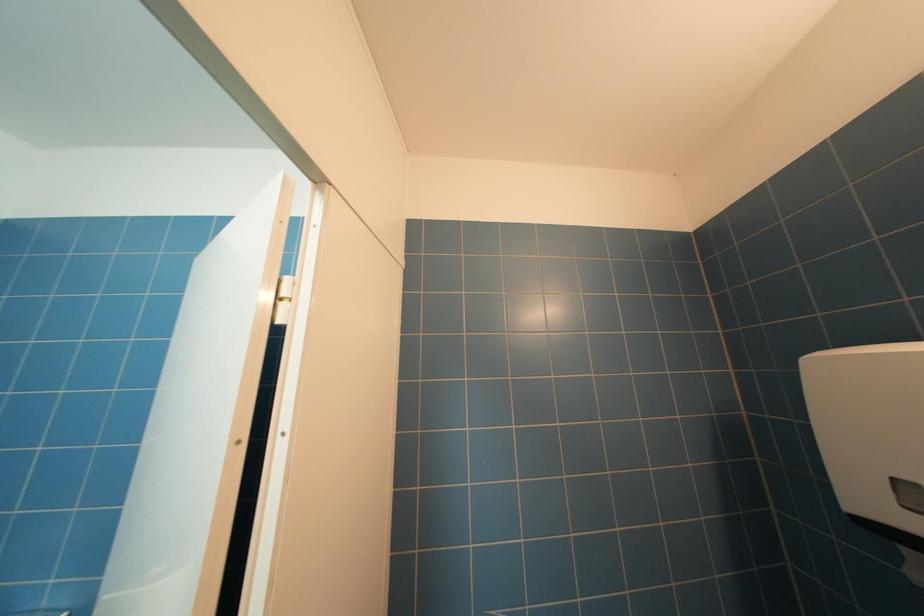
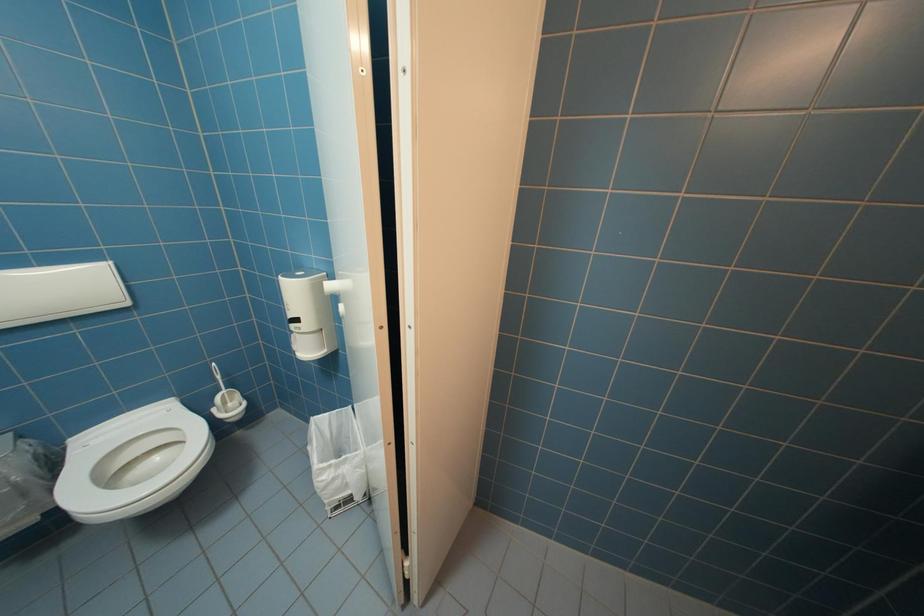
Based on the continuous images, in which direction is the camera rotating?

The camera's rotation is toward left-down.